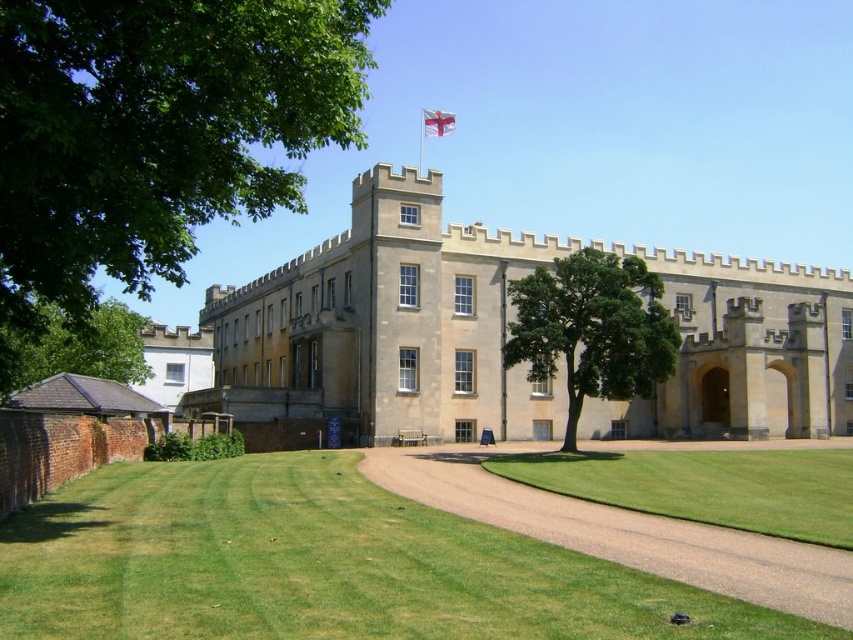
Who is more distant from viewer, (x=381, y=164) or (x=12, y=371)?

Point (x=381, y=164)

Between beige stone castle at center and green leafy tree at lower left, which one has less height?

green leafy tree at lower left is shorter.

The image size is (853, 640). Describe the element at coordinates (393, 321) in the screenshot. I see `beige stone castle at center` at that location.

Identify the location of beige stone castle at center. This screenshot has height=640, width=853. (393, 321).

Between point (165, 470) and point (329, 29), which one is positioned in front?

Point (329, 29)

Who is lower down, green grass at lower left or green leafy tree at upper left?

green grass at lower left

Who is more forward, (177, 552) or (352, 131)?

Point (177, 552) is more forward.

Image resolution: width=853 pixels, height=640 pixels. I want to click on green grass at lower left, so (x=318, y=564).

Is green leafy tree at upper left closer to the viewer compared to green leafy tree at lower left?

Yes, it is in front of green leafy tree at lower left.

Does green leafy tree at upper left have a lesser width compared to green leafy tree at lower left?

Incorrect, green leafy tree at upper left's width is not less than green leafy tree at lower left's.

Image resolution: width=853 pixels, height=640 pixels. In order to click on green leafy tree at upper left in this screenshot , I will do `click(157, 131)`.